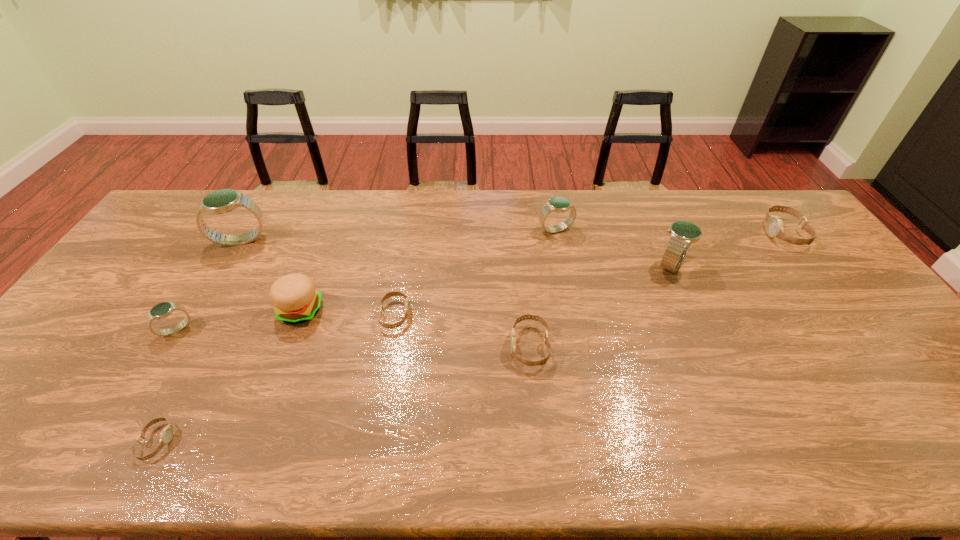
Where is `vacant space positioned on the right of the beige hamburger`? vacant space positioned on the right of the beige hamburger is located at coordinates (397, 310).

The image size is (960, 540). In order to click on vacant region located 0.270m on the back of the smallest blue watch in this screenshot , I will do `click(223, 253)`.

You are a GUI agent. You are given a task and a screenshot of the screen. Output one action in this format:
    pyautogui.click(x=<x>, y=<y>)
    Task: Click on the blank area located 0.400m on the face of the rightmost object
    
    Given the screenshot: What is the action you would take?
    pyautogui.click(x=646, y=233)

Identify the location of free region located on the face of the rightmost object. (714, 233).

Locate an element on the screen. This screenshot has width=960, height=540. vacant position located on the face of the rightmost object is located at coordinates (664, 233).

Where is `vacant space situated on the face of the fifth watch from left to right`? The height and width of the screenshot is (540, 960). vacant space situated on the face of the fifth watch from left to right is located at coordinates click(x=479, y=346).

Image resolution: width=960 pixels, height=540 pixels. I want to click on free space located 0.210m on the face of the fifth watch from left to right, so click(x=429, y=346).

You are a GUI agent. You are given a task and a screenshot of the screen. Output one action in this format:
    pyautogui.click(x=<x>, y=<y>)
    Task: Click on the vacant space located 0.080m on the face of the fifth watch from left to right
    The height and width of the screenshot is (540, 960).
    Given the screenshot: What is the action you would take?
    pyautogui.click(x=479, y=346)

I want to click on blank space located 0.240m on the face of the second shortest object, so click(496, 315).

I want to click on vacant space located 0.110m on the face of the nearest watch, so click(221, 442).